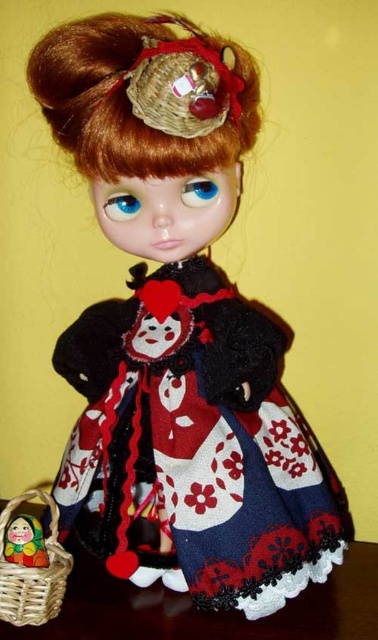
You are organizing a small event and need to choose between the woven brown basket at lower left and the matte yellow basket at lower left for holding decorations. Based on their sizes, which basket would be more suitable for holding taller items?

The woven brown basket at lower left is much taller than the matte yellow basket at lower left, so it would be more suitable for holding taller items.

You are organizing a small party and need to place a centerpiece on the wooden table at lower left. However, there is a woven brown basket at lower left in the way. Can you place the centerpiece on the table without moving the basket?

The wooden table at lower left is below the woven brown basket at lower left, meaning the basket is on top of the table. Therefore, you cannot place the centerpiece there without moving the basket.

You are organizing a small event and need to place two baskets in a specific arrangement. You have a woven brown basket at lower left and a matte yellow basket at lower left. According to the image, which basket should be placed to the right side when setting them up?

The woven brown basket at lower left should be placed to the right side of the matte yellow basket at lower left as per the image description.